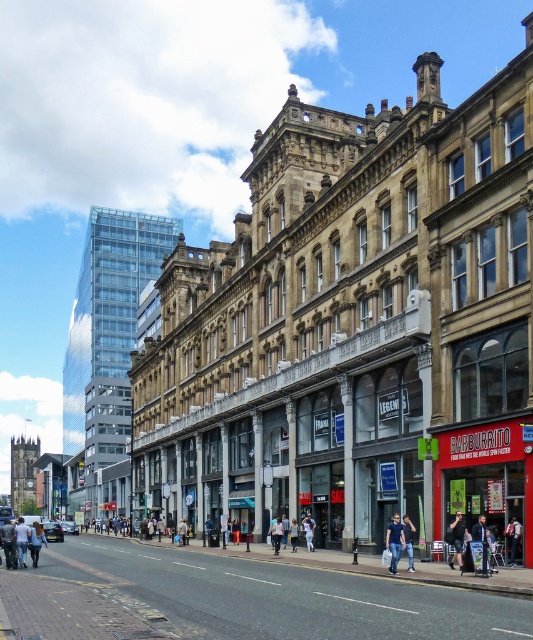
Question: Does smooth asphalt road at center have a larger size compared to denim pants at lower left?

Choices:
 (A) no
 (B) yes

Answer: (B)

Question: Estimate the real-world distances between objects in this image. Which object is closer to the smooth asphalt road at center?

Choices:
 (A) black fabric person at center
 (B) denim jeans at center

Answer: (B)

Question: Which of these objects is positioned closest to the red brick building at lower right?

Choices:
 (A) dark blue jeans at center
 (B) smooth asphalt road at center
 (C) black fabric person at center

Answer: (C)

Question: Which of the following is the closest to the observer?

Choices:
 (A) black fabric person at center
 (B) denim jeans at center
 (C) smooth asphalt road at center

Answer: (C)

Question: Does red brick building at lower right have a lesser width compared to black fabric person at center?

Choices:
 (A) no
 (B) yes

Answer: (A)

Question: Observing the image, what is the correct spatial positioning of red brick building at lower right in reference to black fabric person at center?

Choices:
 (A) above
 (B) below

Answer: (A)